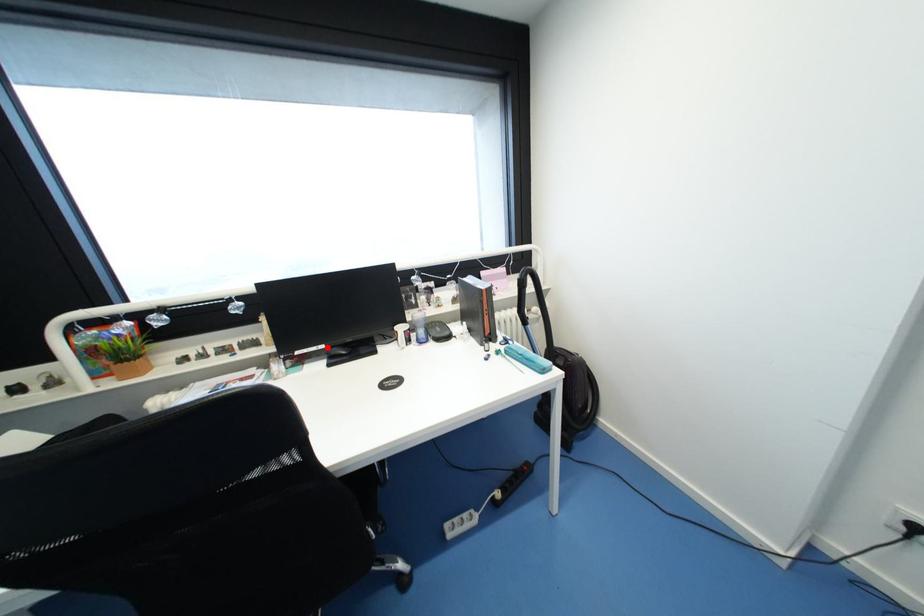
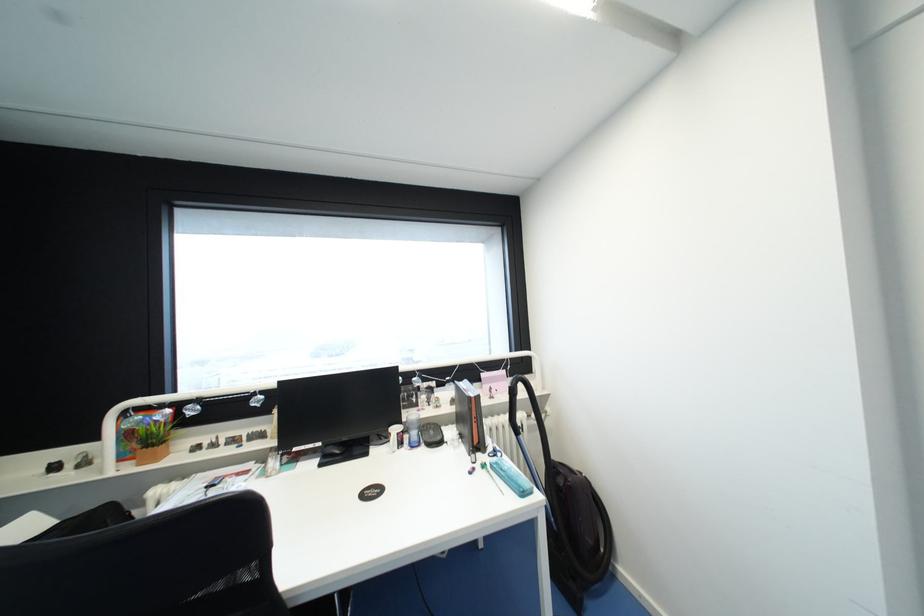
Locate, in the second image, the point that corresponds to the highlighted location in the first image.

(323, 445)